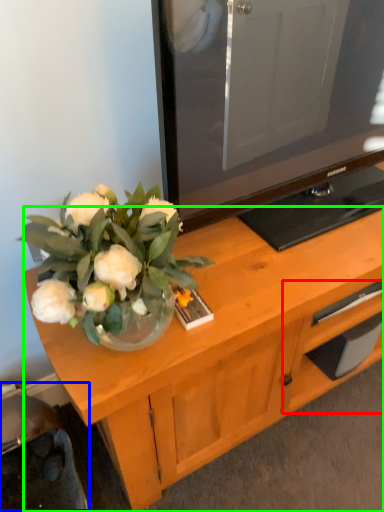
Question: Which object is positioned farthest from drawer (highlighted by a red box)? Select from swivel chair (highlighted by a blue box) and desk (highlighted by a green box).

Choices:
 (A) swivel chair
 (B) desk

Answer: (A)